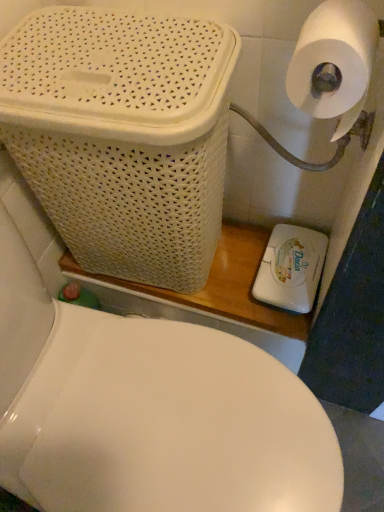
Find the location of a particular element. The height and width of the screenshot is (512, 384). free area in between white wicker basket at upper left and white plastic soap dispenser at lower right is located at coordinates (245, 275).